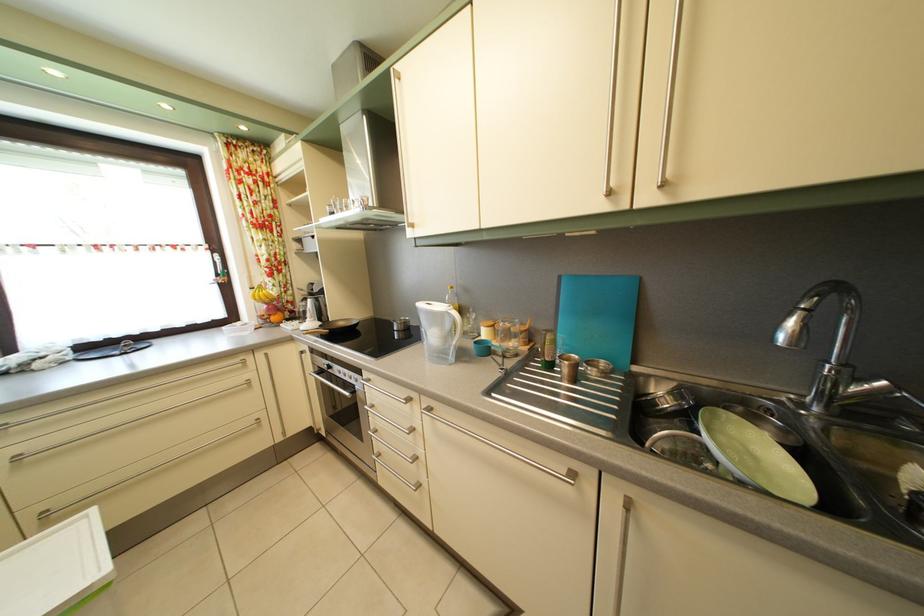
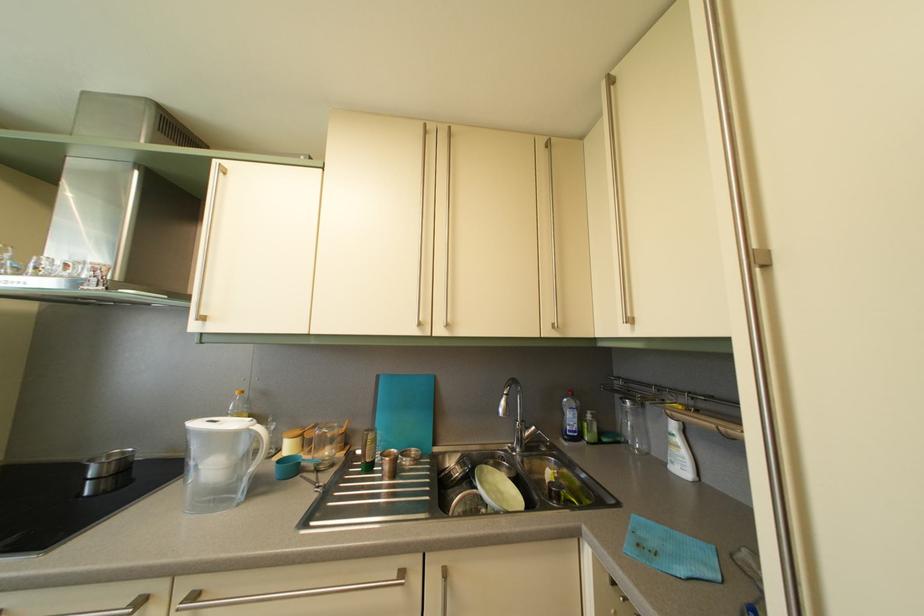
The point at (x=657, y=206) is marked in the first image. Where is the corresponding point in the second image?

(447, 339)